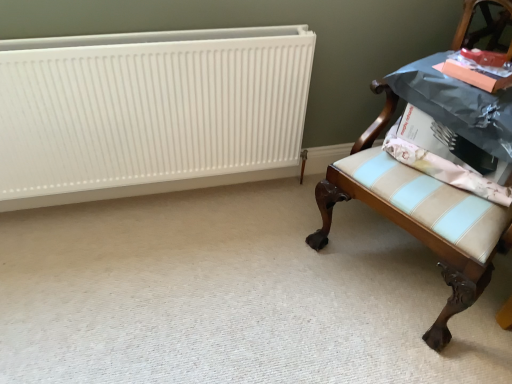
Question: Is point (483, 188) positioned closer to the camera than point (499, 246)?

Choices:
 (A) farther
 (B) closer

Answer: (B)

Question: Is light blue striped fabric at right inside the boundaries of wooden upholstered chair at right, or outside?

Choices:
 (A) outside
 (B) inside

Answer: (B)

Question: Which object is the farthest from the white matte radiator at upper left?

Choices:
 (A) wooden upholstered chair at right
 (B) light blue striped fabric at right

Answer: (B)

Question: Which of these objects is positioned farthest from the white matte radiator at upper left?

Choices:
 (A) light blue striped fabric at right
 (B) wooden upholstered chair at right

Answer: (A)